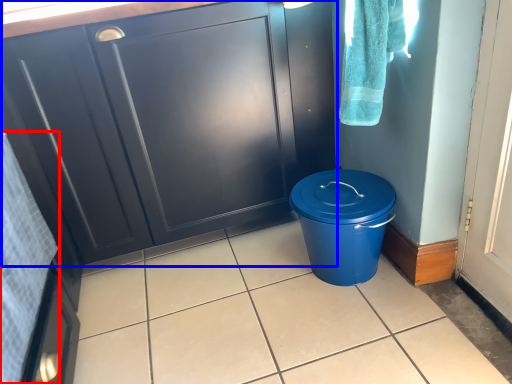
Question: Which object appears farthest to the camera in this image, bath towel (highlighted by a red box) or cabinetry (highlighted by a blue box)?

Choices:
 (A) bath towel
 (B) cabinetry

Answer: (B)